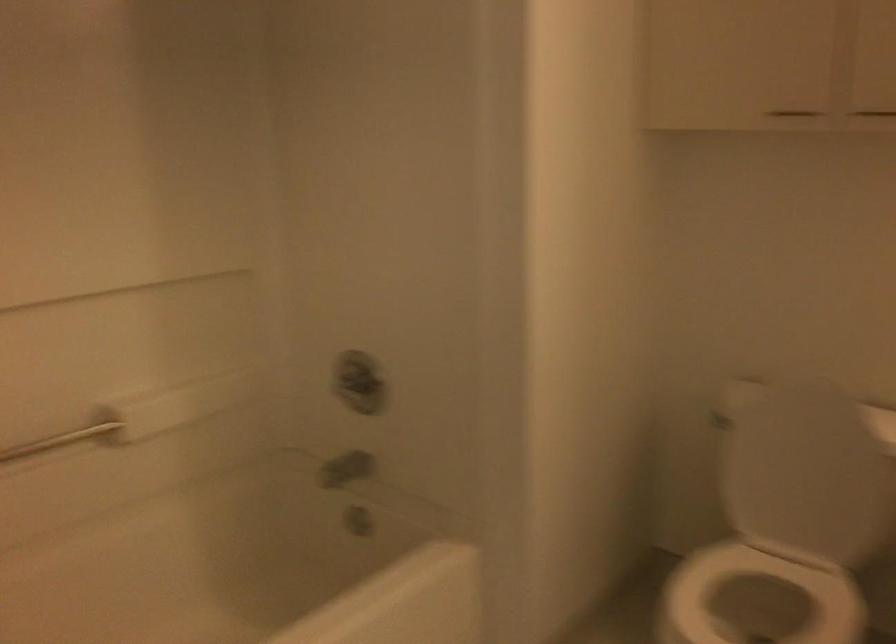
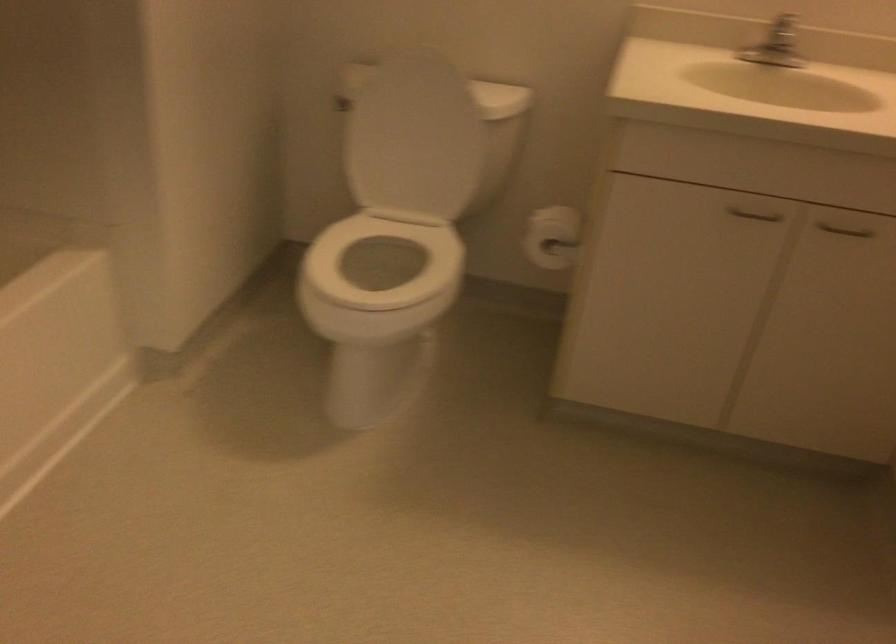
First-person continuous shooting, in which direction is the camera rotating?

The camera rotated toward right-down.